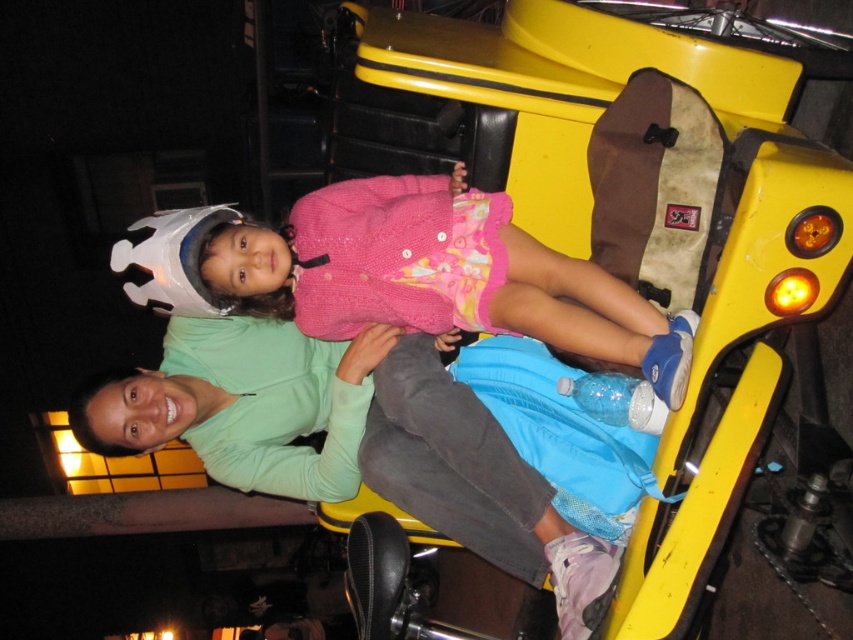
You are standing in an amusement park and see a yellow go kart with two people. There is a point at coordinates [218,356] in the image. If you want to throw a ball to that point, will it land within 3 meters of where you are standing?

The point at coordinates [218,356] is 2.58 meters away from the viewer, so yes, throwing the ball to that point will land it within 3 meters of where you are standing.

You are a photographer taking a picture of the scene. You notice two points marked in the image at coordinates point (310, 392) and point (207, 208). Which point should you focus on to ensure the subject closer to the camera is in sharp focus?

Point (207, 208) should be focused on because it is closer to the camera than point (310, 392), so focusing there will keep the nearer subject sharp.